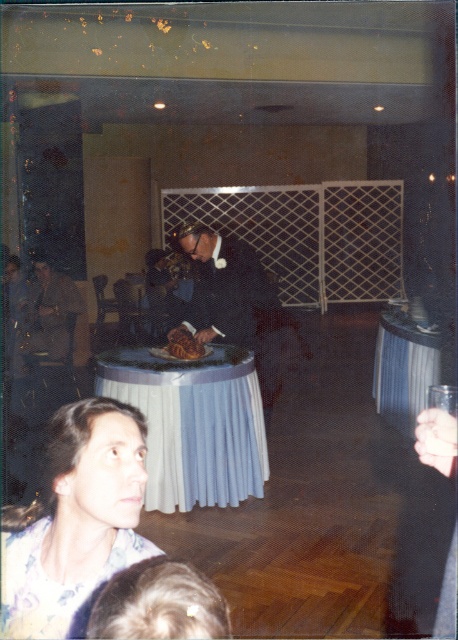
You are a guest at the wedding reception and want to find the white cloth table at center. Which direction should you look relative to the blue pleated tablecloth at center?

The white cloth table at center is to the right of the blue pleated tablecloth at center.

You are a photographer at a wedding reception and need to capture a shot of the floral print blouse at lower left and the brown leather jacket at left. Based on their positions, which one is closer to the camera?

The floral print blouse at lower left is closer to the camera because it is positioned below the brown leather jacket at left, indicating it is in a lower plane and thus nearer to the observer.

You are at a wedding reception and want to take a photo of the floral print blouse at lower left. The photographer tells you that the optimal focal point for the camera is at coordinates point (75, 520). Is this the correct location to focus on for capturing the floral print blouse at lower left?

Yes, the point (75, 520) corresponds to the floral print blouse at lower left, so focusing there would correctly capture it.